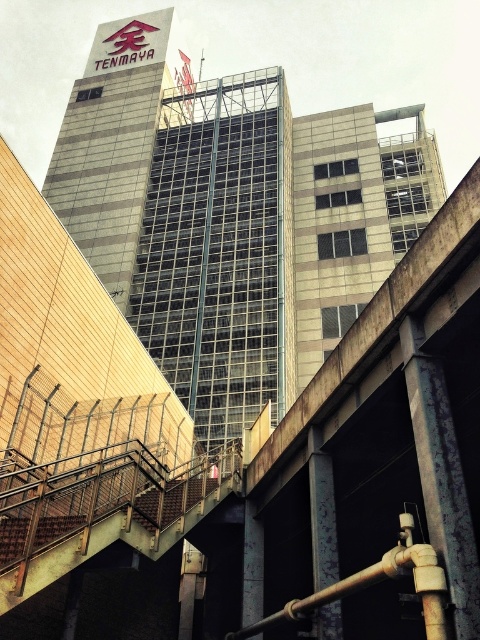
Question: Can you confirm if gray glass building at upper center is positioned above brown wooden stairs at lower center?

Choices:
 (A) no
 (B) yes

Answer: (B)

Question: Which point is farther from the camera taking this photo?

Choices:
 (A) (137, 241)
 (B) (385, 333)

Answer: (A)

Question: Is concrete bridge at center to the right of brown wooden stairs at lower center from the viewer's perspective?

Choices:
 (A) no
 (B) yes

Answer: (B)

Question: Does gray glass building at upper center have a smaller size compared to brown wooden stairs at lower center?

Choices:
 (A) no
 (B) yes

Answer: (A)

Question: Which of the following is the closest to the observer?

Choices:
 (A) brown wooden stairs at lower center
 (B) concrete bridge at center

Answer: (B)

Question: Among these objects, which one is nearest to the camera?

Choices:
 (A) concrete bridge at center
 (B) gray glass building at upper center

Answer: (A)